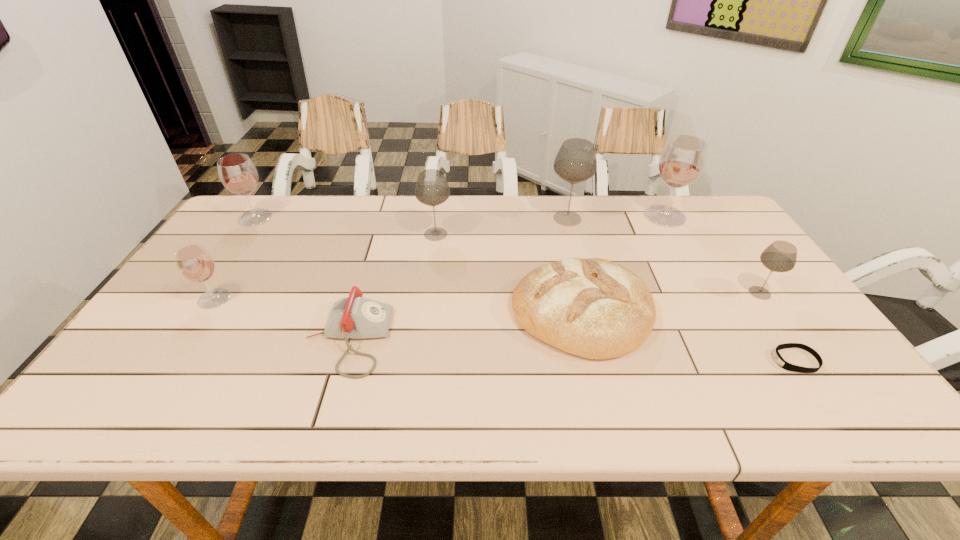
At what (x,y) coordinates should I click in order to perform the action: click on vacant space positioned on the back of the bread. Please return your answer as a coordinate pair (x, y). Looking at the image, I should click on (564, 239).

The image size is (960, 540). Identify the location of vacant region located on the dial of the telephone. (493, 339).

Locate an element on the screen. This screenshot has height=540, width=960. vacant space located 0.230m on the display of the wristband is located at coordinates (672, 361).

Find the location of a particular element. free space located 0.380m on the display of the wristband is located at coordinates (606, 361).

Identify the location of free point located 0.280m on the display of the wristband. This screenshot has width=960, height=540. (650, 361).

This screenshot has width=960, height=540. In order to click on wristband situated at the right edge in this screenshot , I will do `click(781, 362)`.

The width and height of the screenshot is (960, 540). Identify the location of object located in the far left corner section of the desktop. (237, 172).

This screenshot has height=540, width=960. I want to click on object at the far right corner, so click(x=683, y=158).

Identify the location of vacant space at the far edge of the desktop. (656, 195).

In the image, there is a desktop. Identify the location of vacant space at the near edge. (709, 388).